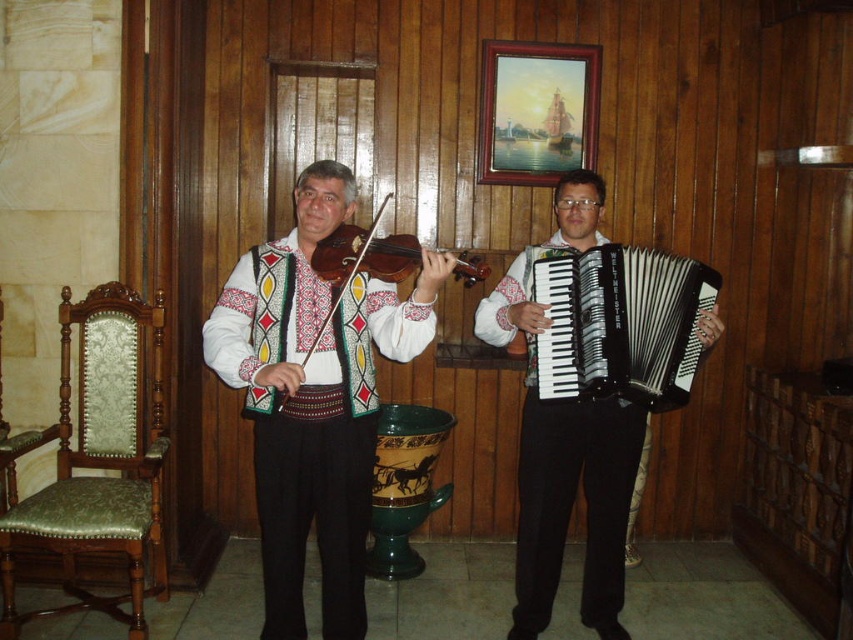
Consider the image. Can you confirm if white embroidered vest at center is smaller than black matte accordion at right?

Actually, white embroidered vest at center might be larger than black matte accordion at right.

Does point (244, 348) come in front of point (596, 241)?

Yes, point (244, 348) is in front of point (596, 241).

Where is `white embroidered vest at center`? white embroidered vest at center is located at coordinates (299, 410).

Is white embroidered vest at center to the left of green fabric armchair at left from the viewer's perspective?

In fact, white embroidered vest at center is to the right of green fabric armchair at left.

Can you confirm if white embroidered vest at center is shorter than green fabric armchair at left?

No.

Locate an element on the screen. The image size is (853, 640). white embroidered vest at center is located at coordinates (299, 410).

Who is lower down, matte white violin at center or green fabric armchair at left?

green fabric armchair at left

Measure the distance between matte white violin at center and green fabric armchair at left.

matte white violin at center and green fabric armchair at left are 28.17 inches apart from each other.

In order to click on matte white violin at center in this screenshot , I will do `click(314, 397)`.

Identify the location of matte white violin at center. Image resolution: width=853 pixels, height=640 pixels. (314, 397).